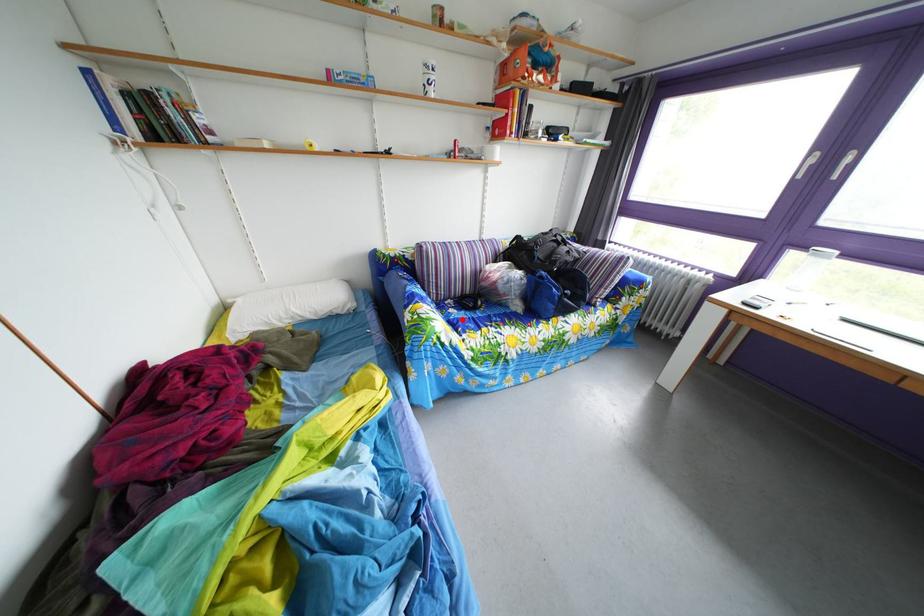
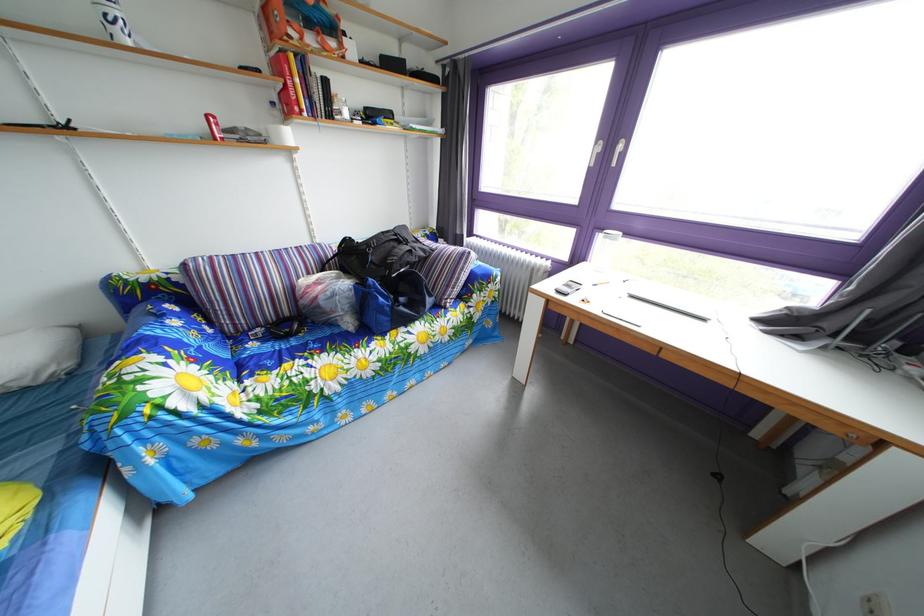
Where in the second image is the point corresponding to the highlighted location from the first image?

(262, 353)